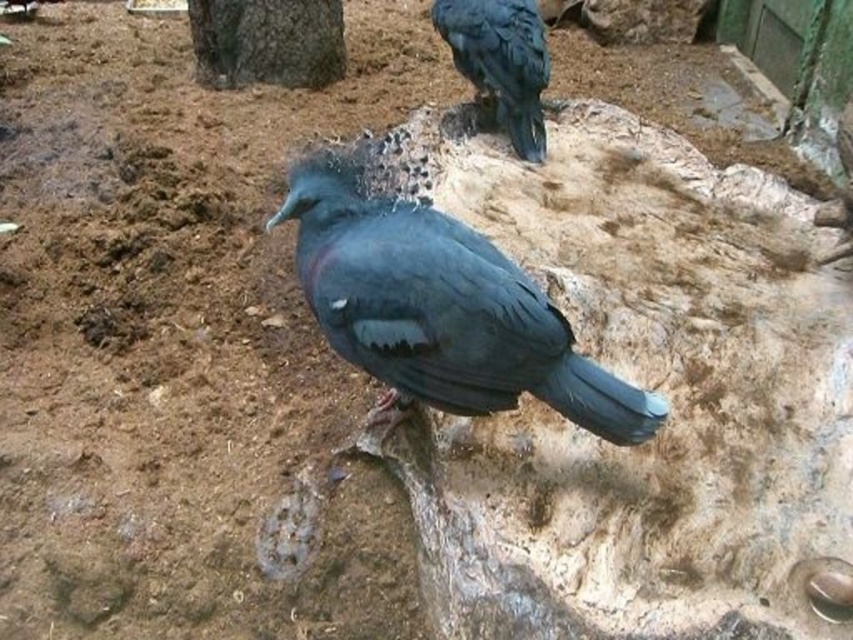
Question: Among these objects, which one is nearest to the camera?

Choices:
 (A) shiny black bird at upper right
 (B) shiny blue bird at center

Answer: (B)

Question: Which object is closer to the camera taking this photo?

Choices:
 (A) shiny black bird at upper right
 (B) shiny blue bird at center

Answer: (B)

Question: Is the position of shiny blue bird at center less distant than that of shiny black bird at upper right?

Choices:
 (A) no
 (B) yes

Answer: (B)

Question: Is shiny blue bird at center to the left of shiny black bird at upper right from the viewer's perspective?

Choices:
 (A) yes
 (B) no

Answer: (A)

Question: Does shiny blue bird at center come in front of shiny black bird at upper right?

Choices:
 (A) yes
 (B) no

Answer: (A)